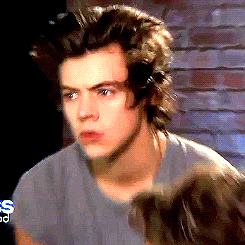
Where is `brick wall`? Image resolution: width=245 pixels, height=245 pixels. brick wall is located at coordinates (233, 69), (235, 158).